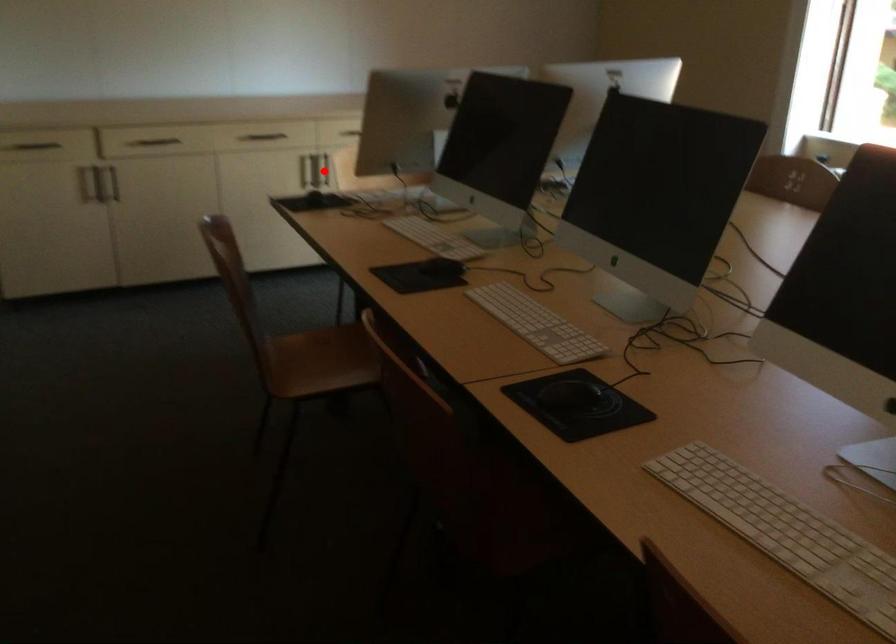
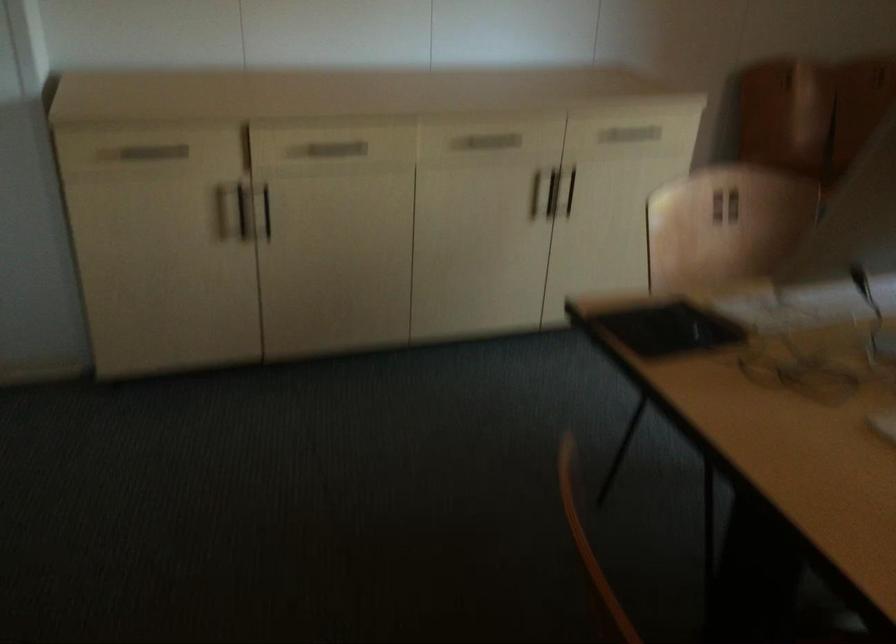
Question: I am providing you with two images of the same scene from different viewpoints. Given a red point in image1, look at the same physical point in image2. Is it:

Choices:
 (A) Closer to the viewpoint
 (B) Farther from the viewpoint

Answer: (A)